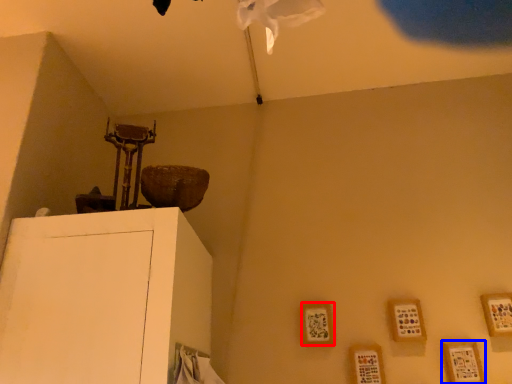
Question: Among these objects, which one is farthest to the camera, picture frame (highlighted by a red box) or picture frame (highlighted by a blue box)?

Choices:
 (A) picture frame
 (B) picture frame

Answer: (A)